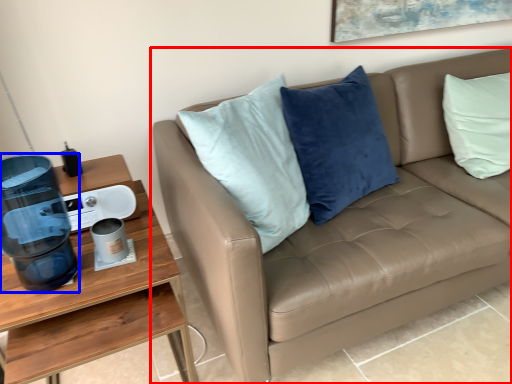
Question: Which object is closer to the camera taking this photo, studio couch (highlighted by a red box) or water cooler (highlighted by a blue box)?

Choices:
 (A) studio couch
 (B) water cooler

Answer: (A)